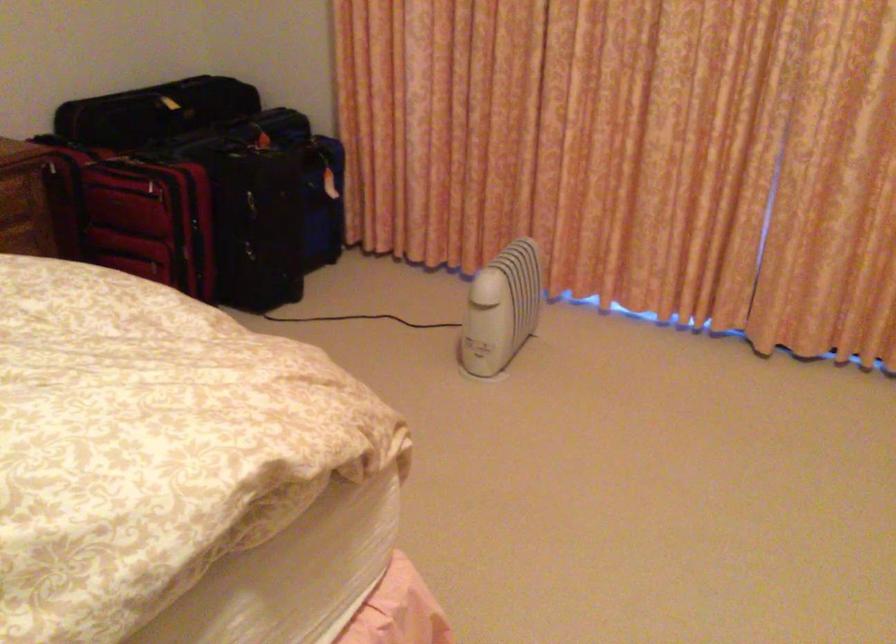
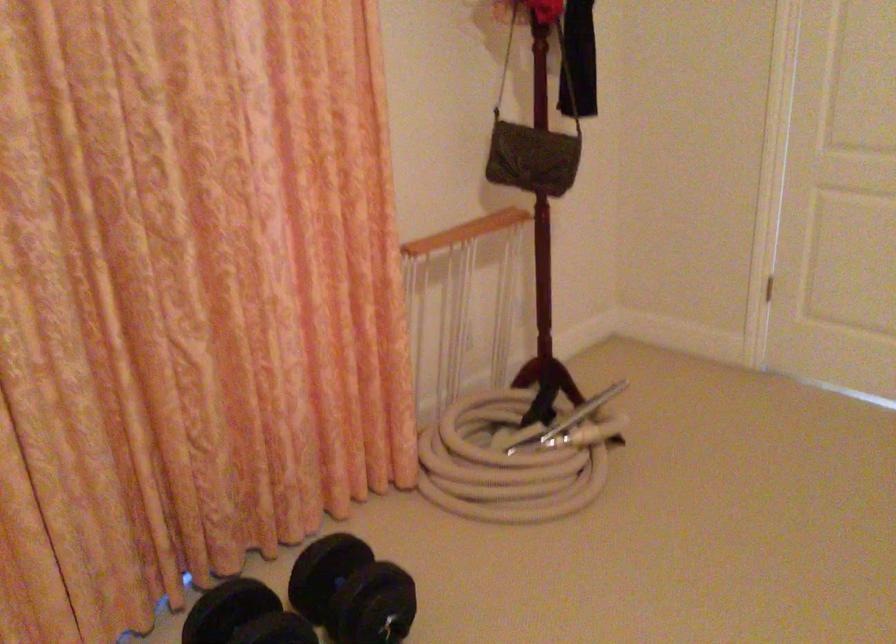
Question: The camera is either moving clockwise (left) or counter-clockwise (right) around the object. The first image is from the beginning of the video and the second image is from the end. Is the camera moving left or right when shooting the video?

Choices:
 (A) Left
 (B) Right

Answer: (A)